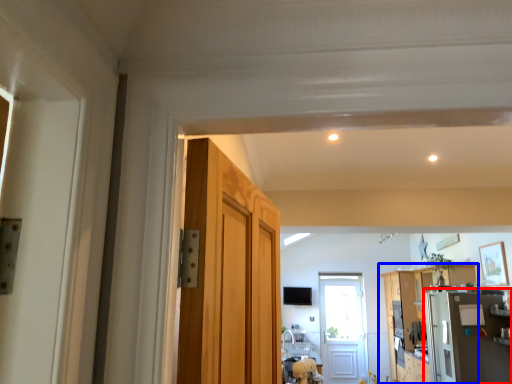
Question: Which point is closer to the camera, appliance (highlighted by a red box) or cabinetry (highlighted by a blue box)?

Choices:
 (A) appliance
 (B) cabinetry

Answer: (A)